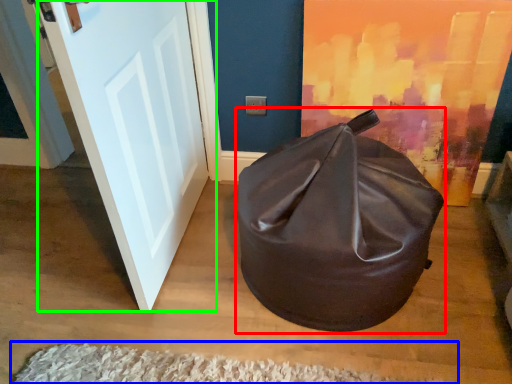
Question: Estimate the real-world distances between objects in this image. Which object is farther from bean bag chair (highlighted by a red box), doormat (highlighted by a blue box) or door (highlighted by a green box)?

Choices:
 (A) doormat
 (B) door

Answer: (B)